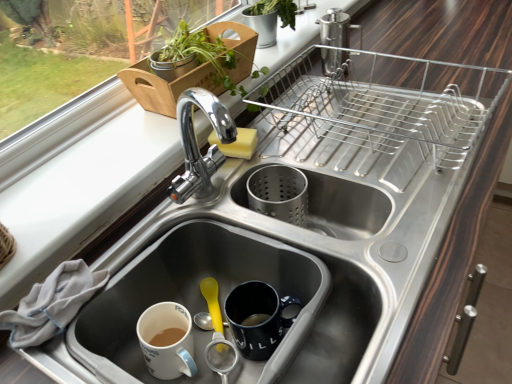
Question: Can you confirm if green leafy plant at upper left, which ranks as the 2th houseplant in back-to-front order, is smaller than white cloth at lower left?

Choices:
 (A) no
 (B) yes

Answer: (A)

Question: Is green leafy plant at upper left, which is counted as the first houseplant, starting from the front, wider than white cloth at lower left?

Choices:
 (A) no
 (B) yes

Answer: (B)

Question: Is green leafy plant at upper left, which ranks as the 2th houseplant in back-to-front order, at the right side of white cloth at lower left?

Choices:
 (A) no
 (B) yes

Answer: (B)

Question: Does green leafy plant at upper left, which is counted as the first houseplant, starting from the front, touch white cloth at lower left?

Choices:
 (A) no
 (B) yes

Answer: (A)

Question: Is green leafy plant at upper left, which ranks as the 2th houseplant in back-to-front order, thinner than white cloth at lower left?

Choices:
 (A) yes
 (B) no

Answer: (B)

Question: Is white cloth at lower left inside green leafy plant at upper left, which ranks as the 2th houseplant in back-to-front order?

Choices:
 (A) no
 (B) yes

Answer: (A)

Question: Does white matte sink at lower left, marked as the second sink in a right-to-left arrangement, have a lesser width compared to yellow sponge at center?

Choices:
 (A) no
 (B) yes

Answer: (A)

Question: Is white matte sink at lower left, the 1th sink viewed from the left, in contact with yellow sponge at center?

Choices:
 (A) yes
 (B) no

Answer: (B)

Question: Can you confirm if white matte sink at lower left, the 1th sink viewed from the left, is smaller than yellow sponge at center?

Choices:
 (A) no
 (B) yes

Answer: (A)

Question: From a real-world perspective, is white matte sink at lower left, the 1th sink viewed from the left, located higher than yellow sponge at center?

Choices:
 (A) yes
 (B) no

Answer: (B)

Question: Could you tell me if white matte sink at lower left, the 1th sink viewed from the left, is facing yellow sponge at center?

Choices:
 (A) yes
 (B) no

Answer: (B)

Question: Does white matte sink at lower left, marked as the second sink in a right-to-left arrangement, have a greater width compared to yellow sponge at center?

Choices:
 (A) no
 (B) yes

Answer: (B)

Question: Considering the relative positions of stainless steel sink at center, acting as the second sink starting from the left, and green matte plant at upper center, the 1th houseplant when ordered from back to front, in the image provided, is stainless steel sink at center, acting as the second sink starting from the left, in front of green matte plant at upper center, the 1th houseplant when ordered from back to front,?

Choices:
 (A) no
 (B) yes

Answer: (B)